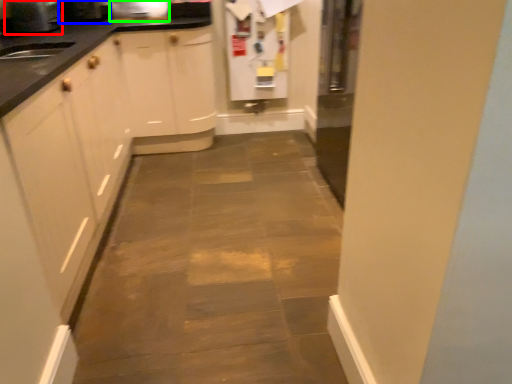
Question: Based on their relative distances, which object is nearer to appliance (highlighted by a red box)? Choose from appliance (highlighted by a blue box) and appliance (highlighted by a green box).

Choices:
 (A) appliance
 (B) appliance

Answer: (A)